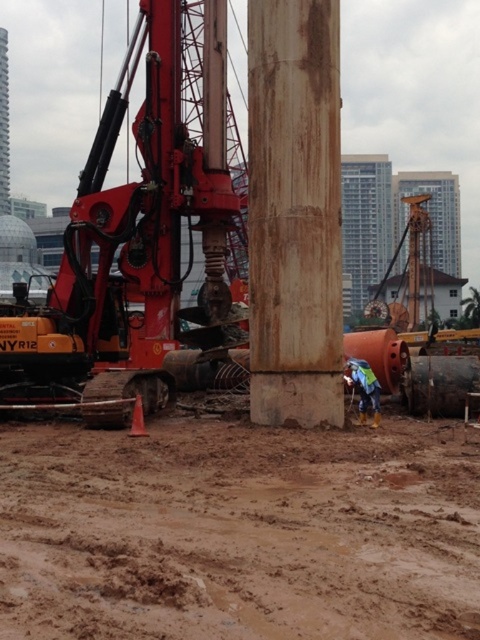
Is brown dirt at lower center to the right of blue reflective safety vest at lower right from the viewer's perspective?

Incorrect, brown dirt at lower center is not on the right side of blue reflective safety vest at lower right.

Who is lower down, brown dirt at lower center or blue reflective safety vest at lower right?

brown dirt at lower center

The image size is (480, 640). Describe the element at coordinates (239, 532) in the screenshot. I see `brown dirt at lower center` at that location.

Locate an element on the screen. The height and width of the screenshot is (640, 480). brown dirt at lower center is located at coordinates (239, 532).

Does brown dirt at lower center have a greater height compared to matte orange excavator at left?

No, brown dirt at lower center is not taller than matte orange excavator at left.

Who is more forward, (325, 476) or (96, 205)?

Point (325, 476) is more forward.

Find the location of a particular element. brown dirt at lower center is located at coordinates (239, 532).

Can you confirm if rusty metal pole at center is positioned below blue reflective safety vest at lower right?

Incorrect, rusty metal pole at center is not positioned below blue reflective safety vest at lower right.

Who is taller, rusty metal pole at center or blue reflective safety vest at lower right?

blue reflective safety vest at lower right

I want to click on rusty metal pole at center, so click(295, 212).